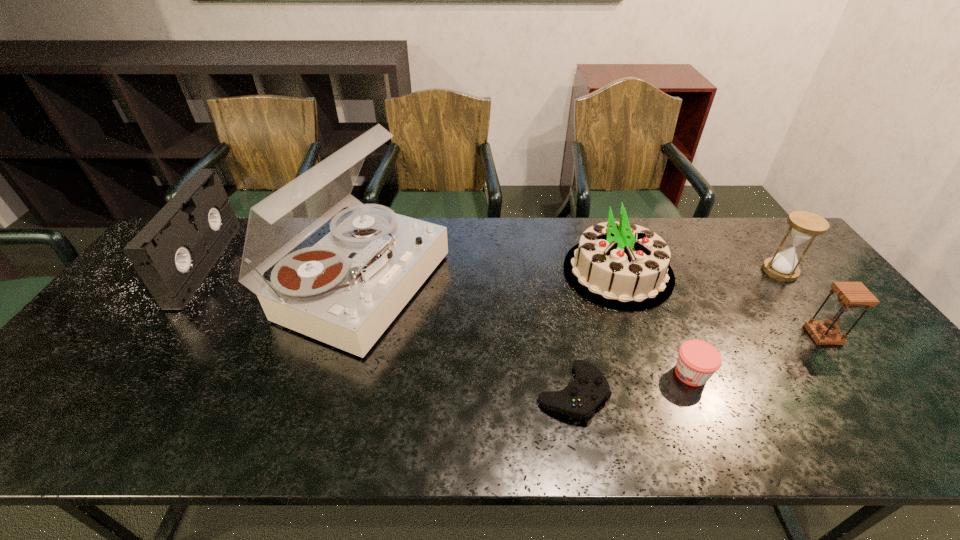
Locate an element on the screen. The image size is (960, 540). vacant space located on the side of the videotape with visible spindles is located at coordinates [300, 265].

Locate an element on the screen. vacant area located 0.360m on the left of the birthday cake is located at coordinates (444, 272).

Find the location of a particular element. vacant region located 0.320m on the left of the farther hourglass is located at coordinates (658, 271).

This screenshot has height=540, width=960. Find the location of `vacant space situated 0.130m on the front of the nearer hourglass`. vacant space situated 0.130m on the front of the nearer hourglass is located at coordinates (864, 389).

Where is `vacant space located 0.230m on the front label of the sixth tallest object`? vacant space located 0.230m on the front label of the sixth tallest object is located at coordinates (575, 374).

You are a GUI agent. You are given a task and a screenshot of the screen. Output one action in this format:
    pyautogui.click(x=<x>, y=<y>)
    Task: Click on the free spot located on the front label of the sixth tallest object
    
    Given the screenshot: What is the action you would take?
    pyautogui.click(x=571, y=374)

The height and width of the screenshot is (540, 960). In order to click on blank space located on the front label of the sixth tallest object in this screenshot , I will do `click(613, 374)`.

Image resolution: width=960 pixels, height=540 pixels. I want to click on free location located on the left of the shortest object, so click(389, 393).

Find the location of `record player at the far edge`. record player at the far edge is located at coordinates (345, 291).

Where is `videotape that is at the far edge`? The image size is (960, 540). videotape that is at the far edge is located at coordinates (173, 254).